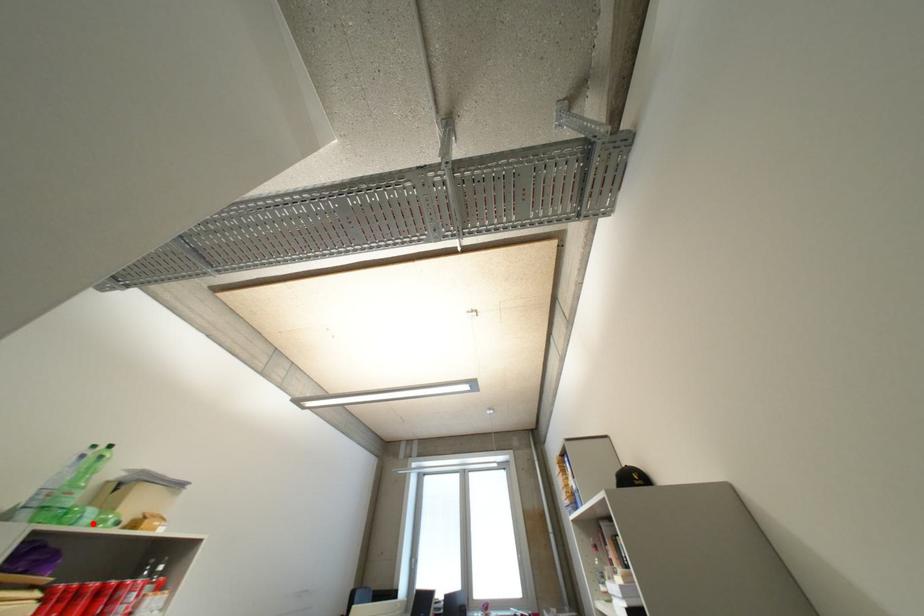
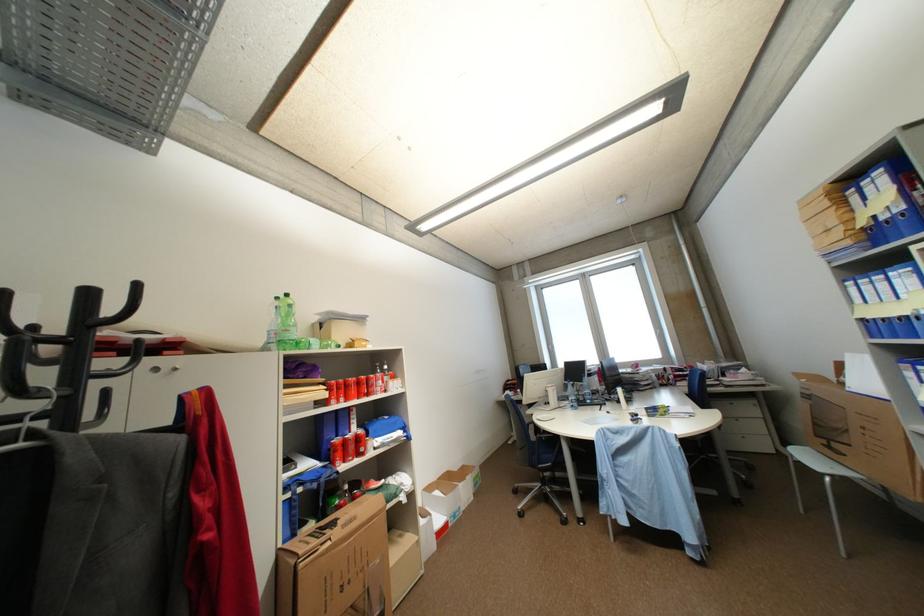
Question: I am providing you with two images of the same scene from different viewpoints. A red point is shown in image1. For the corresponding object point in image2, is it positioned nearer or farther from the camera?

Choices:
 (A) Nearer
 (B) Farther

Answer: (B)